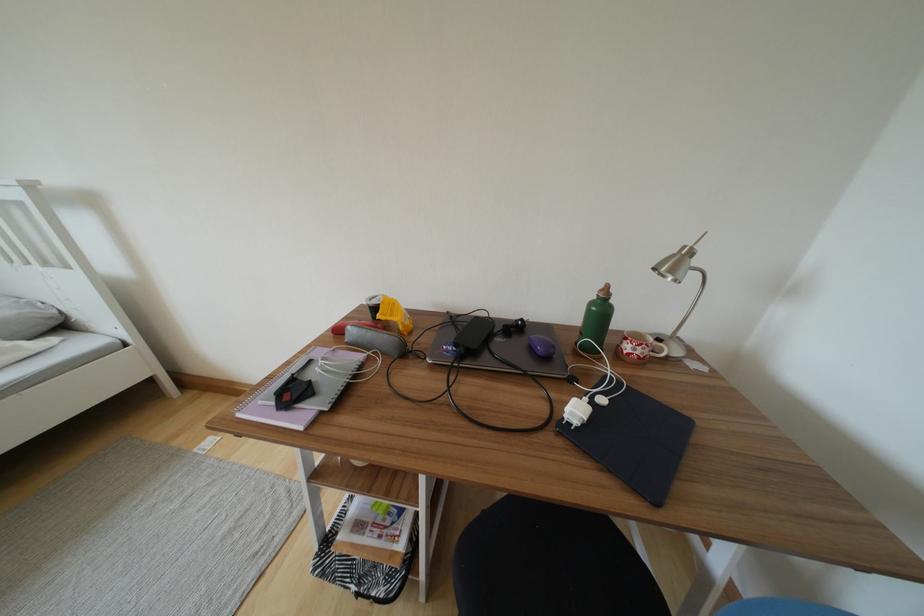
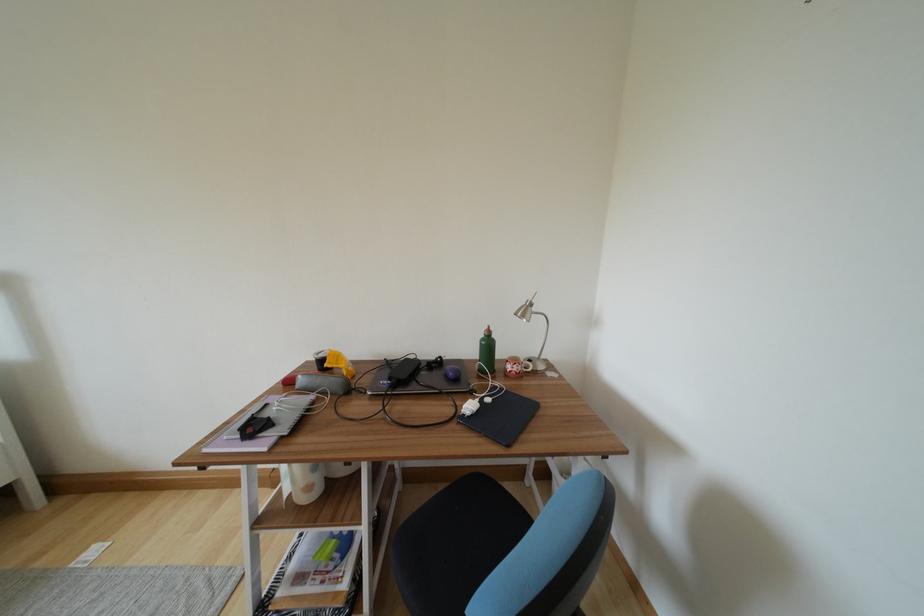
In the second image, find the point that corresponds to point (633, 352) in the first image.

(514, 371)